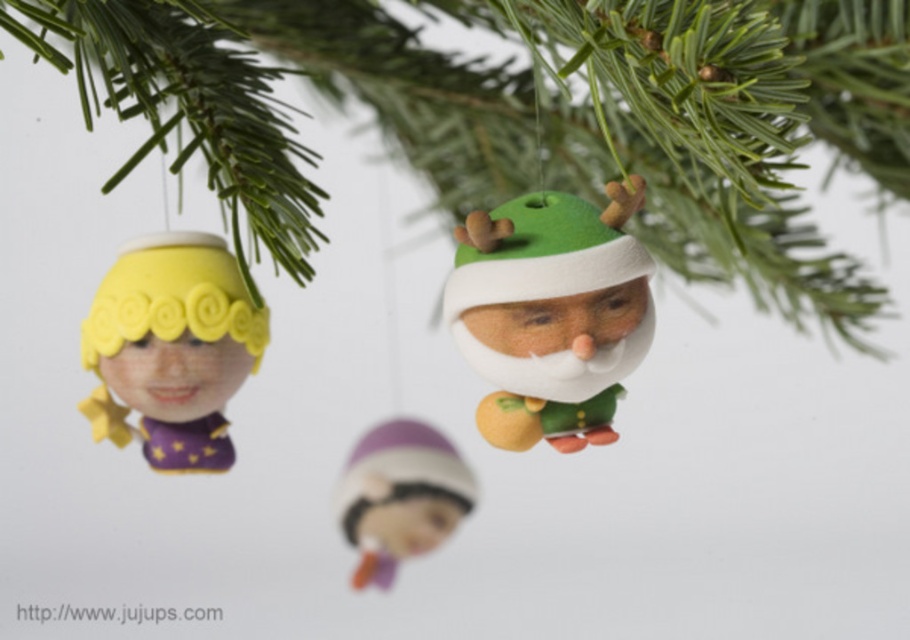
Measure the distance between matte yellow clay figurine at left and purple matte/soft doll at center.

matte yellow clay figurine at left and purple matte/soft doll at center are 9.43 inches apart from each other.

Can you confirm if matte yellow clay figurine at left is positioned below purple matte/soft doll at center?

No.

Between point (174, 330) and point (359, 500), which one is positioned behind?

The point (359, 500) is more distant.

Where is `matte yellow clay figurine at left`? The image size is (910, 640). matte yellow clay figurine at left is located at coordinates point(170,348).

Who is lower down, green matte santa ornament at upper center or matte yellow clay figurine at left?

matte yellow clay figurine at left

Which is in front, point (261, 115) or point (221, 340)?

Point (261, 115) is more forward.

Is point (187, 13) behind point (102, 356)?

No, (187, 13) is in front of (102, 356).

Locate an element on the screen. The height and width of the screenshot is (640, 910). green matte santa ornament at upper center is located at coordinates (528, 113).

Between green felt santa at center and matte yellow clay figurine at left, which one appears on the right side from the viewer's perspective?

green felt santa at center

Can you confirm if green felt santa at center is bigger than matte yellow clay figurine at left?

Yes, green felt santa at center is bigger than matte yellow clay figurine at left.

Identify the location of green felt santa at center. (551, 314).